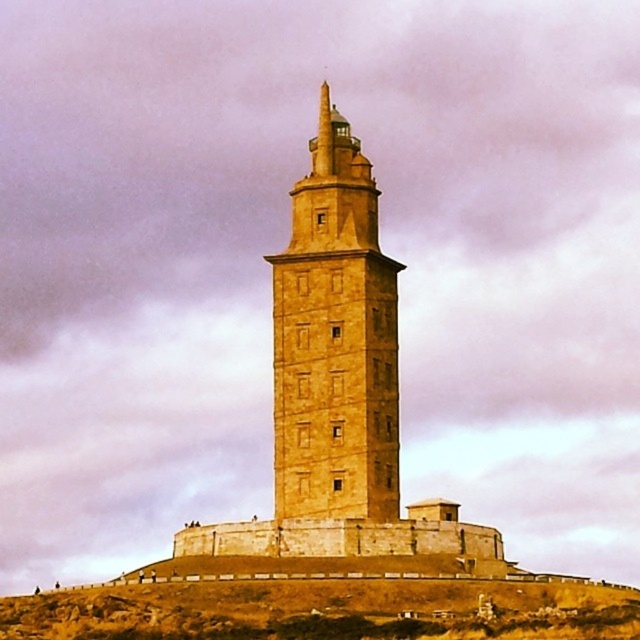
Question: Is golden stone tower at center positioned in front of brown stone hillside at center?

Choices:
 (A) no
 (B) yes

Answer: (A)

Question: Among these objects, which one is farthest from the camera?

Choices:
 (A) golden stone tower at center
 (B) brown stone hillside at center

Answer: (A)

Question: Is golden stone tower at center below brown stone hillside at center?

Choices:
 (A) no
 (B) yes

Answer: (A)

Question: Is golden stone tower at center further to camera compared to brown stone hillside at center?

Choices:
 (A) no
 (B) yes

Answer: (B)

Question: Which point is farther from the camera taking this photo?

Choices:
 (A) (342, 602)
 (B) (355, 310)

Answer: (B)